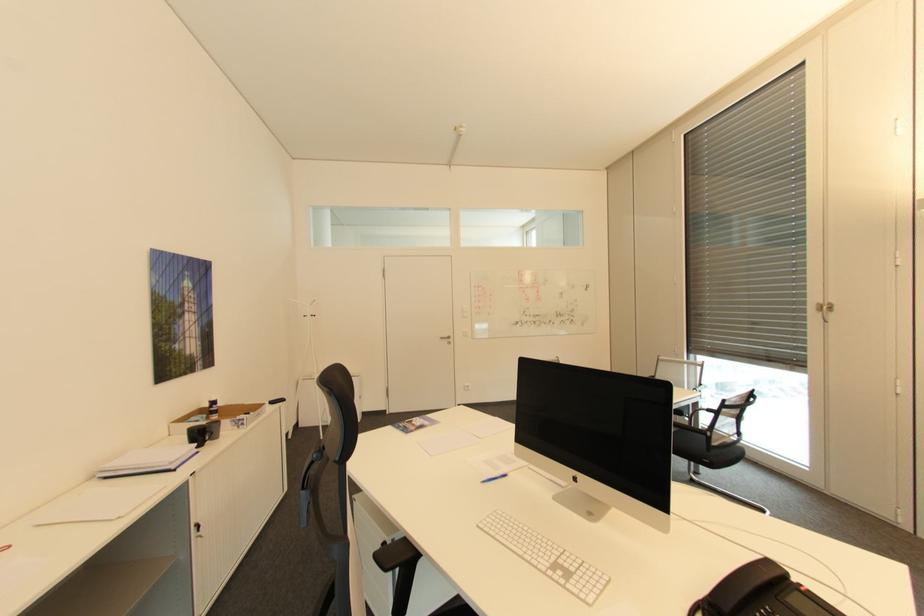
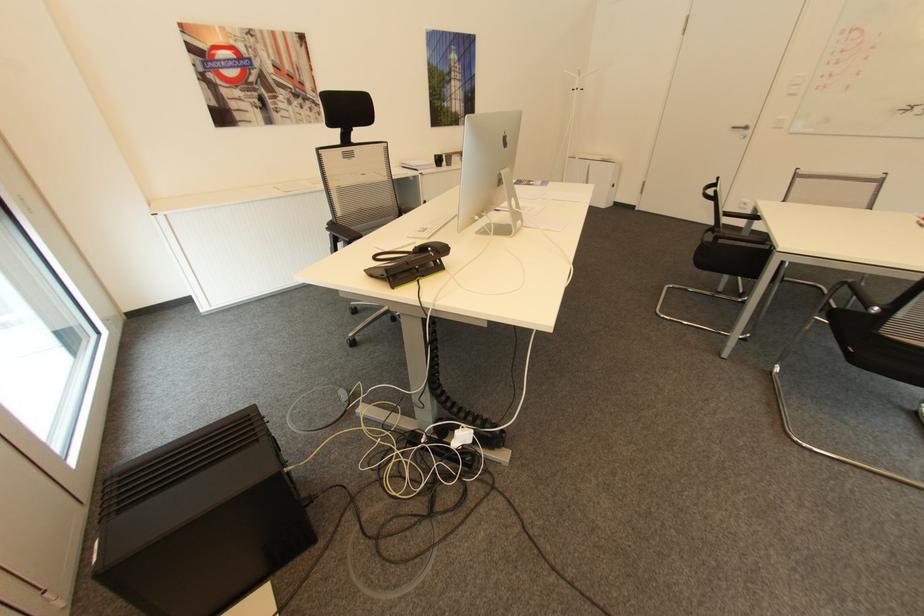
The point at (446, 338) is marked in the first image. Where is the corresponding point in the second image?

(736, 128)